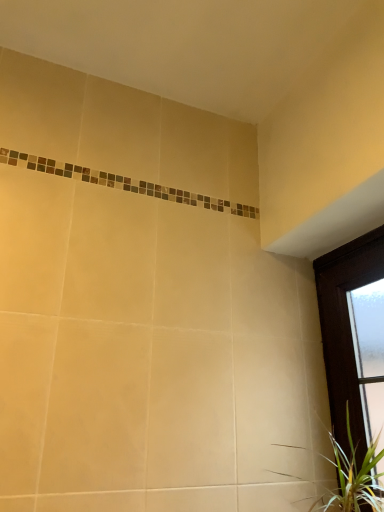
You are a GUI agent. You are given a task and a screenshot of the screen. Output one action in this format:
    pyautogui.click(x=<x>, y=<y>)
    Task: Click on the dark wood window at right
    
    Given the screenshot: What is the action you would take?
    pyautogui.click(x=347, y=332)

Describe the element at coordinates (347, 332) in the screenshot. I see `dark wood window at right` at that location.

Describe the element at coordinates (353, 477) in the screenshot. I see `green leafy plant at lower right` at that location.

Locate an element on the screen. The image size is (384, 512). green leafy plant at lower right is located at coordinates (353, 477).

Identify the location of dark wood window at right. (347, 332).

Can you confirm if green leafy plant at lower right is positioned to the left of dark wood window at right?

Yes.

Is green leafy plant at lower right positioned behind dark wood window at right?

No.

Considering the positions of point (350, 482) and point (371, 380), is point (350, 482) closer or farther from the camera than point (371, 380)?

Clearly, point (350, 482) is closer to the camera than point (371, 380).

From the image's perspective, does green leafy plant at lower right appear lower than dark wood window at right?

Yes, from the image's perspective, green leafy plant at lower right is below dark wood window at right.

From a real-world perspective, does green leafy plant at lower right sit lower than dark wood window at right?

Indeed, from a real-world perspective, green leafy plant at lower right is positioned beneath dark wood window at right.

Can you confirm if green leafy plant at lower right is wider than dark wood window at right?

Yes, green leafy plant at lower right is wider than dark wood window at right.

From their relative heights in the image, would you say green leafy plant at lower right is taller or shorter than dark wood window at right?

Clearly, green leafy plant at lower right is shorter compared to dark wood window at right.

Considering the sizes of objects green leafy plant at lower right and dark wood window at right in the image provided, who is bigger, green leafy plant at lower right or dark wood window at right?

dark wood window at right.

Is green leafy plant at lower right not inside dark wood window at right?

No, green leafy plant at lower right is not outside of dark wood window at right.

Would you consider green leafy plant at lower right to be distant from dark wood window at right?

No, green leafy plant at lower right is not far from dark wood window at right.

Is dark wood window at right at the back of green leafy plant at lower right?

Yes, green leafy plant at lower right is positioned with its back facing dark wood window at right.

The width and height of the screenshot is (384, 512). Find the location of `houseplant in front of the dark wood window at right`. houseplant in front of the dark wood window at right is located at coordinates (353, 477).

Is dark wood window at right to the left of green leafy plant at lower right from the viewer's perspective?

In fact, dark wood window at right is to the right of green leafy plant at lower right.

Is dark wood window at right further to camera compared to green leafy plant at lower right?

Yes, it is behind green leafy plant at lower right.

Is point (356, 459) less distant than point (361, 490)?

No, it is not.

From the image's perspective, which object appears higher, dark wood window at right or green leafy plant at lower right?

dark wood window at right.

From a real-world perspective, which is physically above, dark wood window at right or green leafy plant at lower right?

dark wood window at right is physically above.

Is dark wood window at right wider than green leafy plant at lower right?

In fact, dark wood window at right might be narrower than green leafy plant at lower right.

Can you confirm if dark wood window at right is taller than green leafy plant at lower right?

Yes, dark wood window at right is taller than green leafy plant at lower right.

Considering the sizes of dark wood window at right and green leafy plant at lower right in the image, is dark wood window at right bigger or smaller than green leafy plant at lower right?

Clearly, dark wood window at right is larger in size than green leafy plant at lower right.

Is dark wood window at right situated inside green leafy plant at lower right or outside?

dark wood window at right is inside green leafy plant at lower right.

Is dark wood window at right next to green leafy plant at lower right and touching it?

dark wood window at right is not next to green leafy plant at lower right, and they're not touching.

Is dark wood window at right turned away from green leafy plant at lower right?

Correct, dark wood window at right is looking away from green leafy plant at lower right.

Can you tell me how much dark wood window at right and green leafy plant at lower right differ in facing direction?

0.533 degrees.

Locate an element on the screen. The height and width of the screenshot is (512, 384). window lying on the right of green leafy plant at lower right is located at coordinates (347, 332).

The height and width of the screenshot is (512, 384). What are the coordinates of `window behind the green leafy plant at lower right` in the screenshot? It's located at (347, 332).

Where is `window on the right side of green leafy plant at lower right`? window on the right side of green leafy plant at lower right is located at coordinates (347, 332).